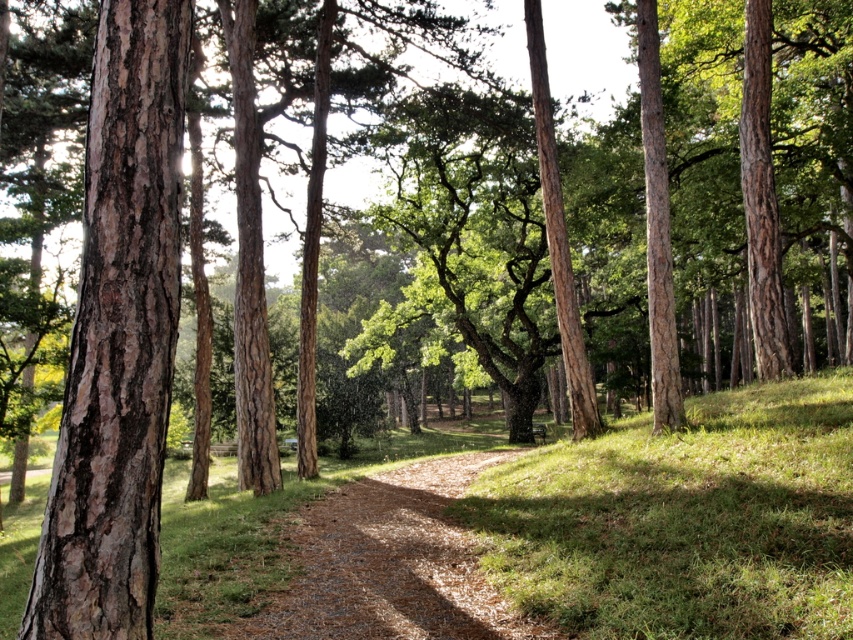
Who is positioned more to the right, smooth brown bark at left or brown gravel path at center?

brown gravel path at center is more to the right.

Does smooth brown bark at left have a larger size compared to brown gravel path at center?

No, smooth brown bark at left is not bigger than brown gravel path at center.

Between point (115, 93) and point (514, 452), which one is positioned in front?

Positioned in front is point (115, 93).

I want to click on smooth brown bark at left, so click(119, 337).